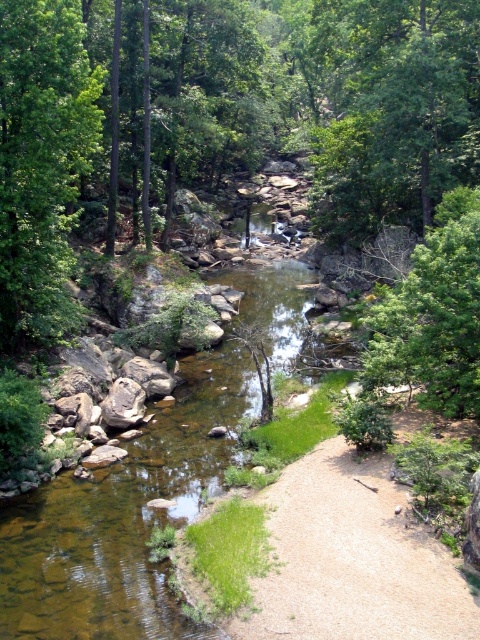
You are a hiker who wants to take a photo of both the green leafy tree at upper center and the green leafy tree at center. Since you have a camera with a fixed focal length, you need to know which tree is wider to frame your shot properly. Which tree has a greater width?

The green leafy tree at upper center has a greater width than the green leafy tree at center.

You are standing on the sandy path next to the stream and want to take a photo of both the green leafy tree at upper center and the green leafy tree at left. Which tree should you position yourself closer to in order to capture both in a single frame without moving the camera?

Since the green leafy tree at upper center is much taller than the green leafy tree at left, you should position yourself closer to the green leafy tree at left to include both in the frame. This is because the shorter tree will require less vertical space, allowing the taller tree to still be within the camera frame when positioned closer.

You are a hiker who wants to take a photo of both the green leafy tree at upper center and the green leafy tree at center in the same frame. Given that your camera has a maximum focal length of 50mm, can you determine if the two trees are within the camera range to be captured together?

The green leafy tree at upper center is 13.93 meters away from the green leafy tree at center. Since the distance between them is 13.93 meters, and your camera has a maximum focal length of 50mm, it is possible to capture both trees in the same frame as long as you position yourself appropriately to include both within the camera lens range.